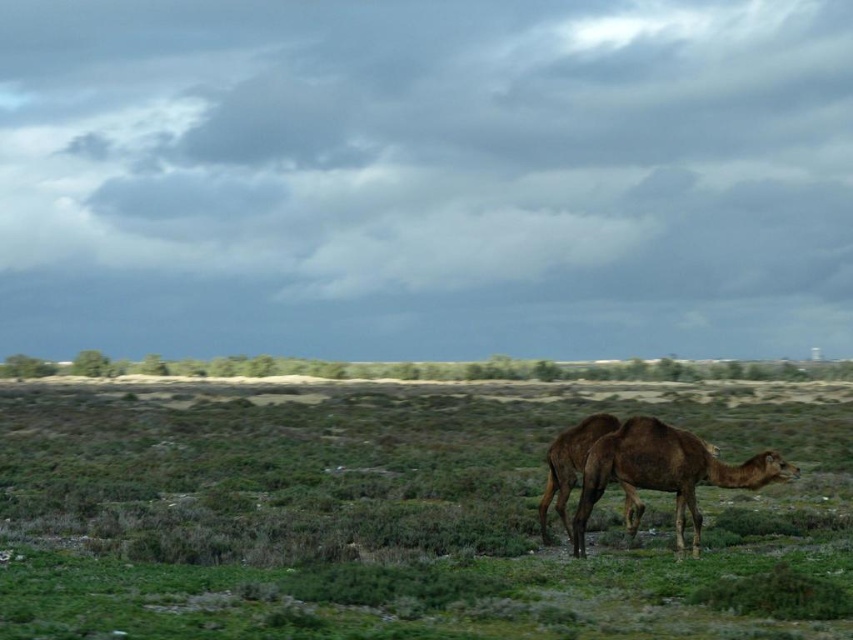
Can you confirm if green grassy at center is bigger than brown matte camel at lower right?

Yes, green grassy at center is bigger than brown matte camel at lower right.

Is point (683, 385) positioned before point (689, 460)?

No.

Where is `green grassy at center`? The image size is (853, 640). green grassy at center is located at coordinates (402, 515).